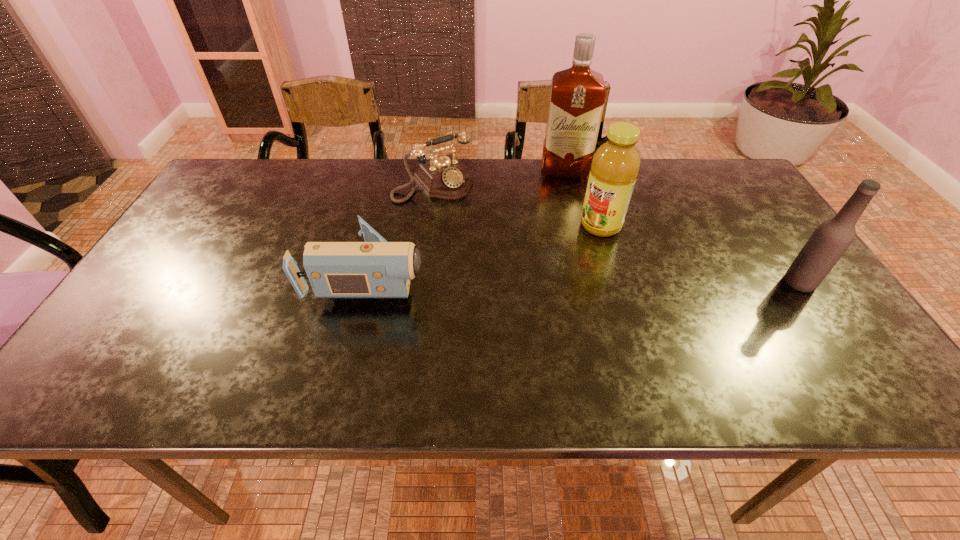
Where is `free space on the desktop that is between the camcorder and the beer bottle and is positioned on the front label of the fruit juice`? free space on the desktop that is between the camcorder and the beer bottle and is positioned on the front label of the fruit juice is located at coordinates (538, 278).

Where is `free space on the desktop that is between the camcorder and the rightmost object and is positioned on the dial of the telephone`? free space on the desktop that is between the camcorder and the rightmost object and is positioned on the dial of the telephone is located at coordinates (518, 278).

At what (x,y) coordinates should I click in order to perform the action: click on free space on the desktop that is between the camcorder and the rightmost object and is positioned on the front label of the tallest object. Please return your answer as a coordinate pair (x, y). Looking at the image, I should click on (570, 278).